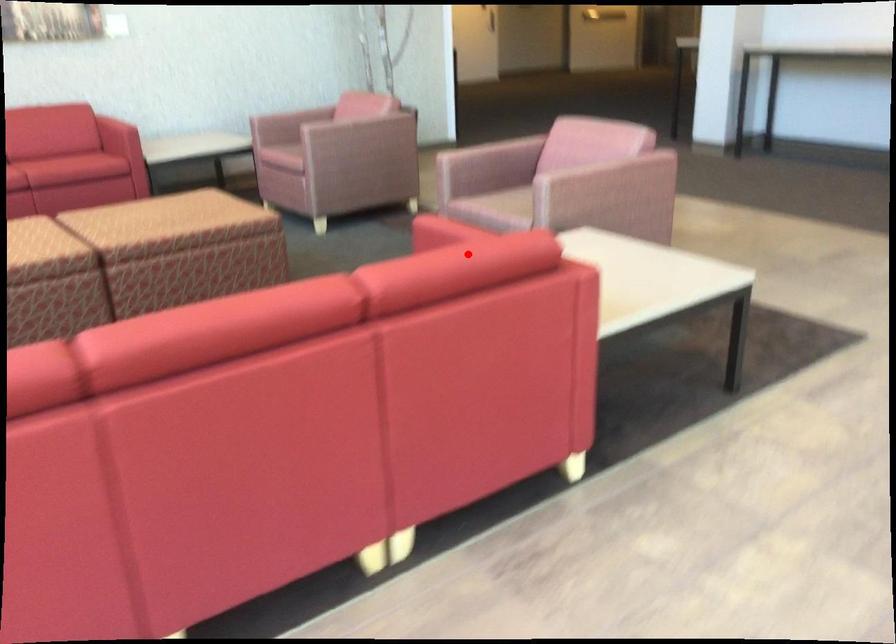
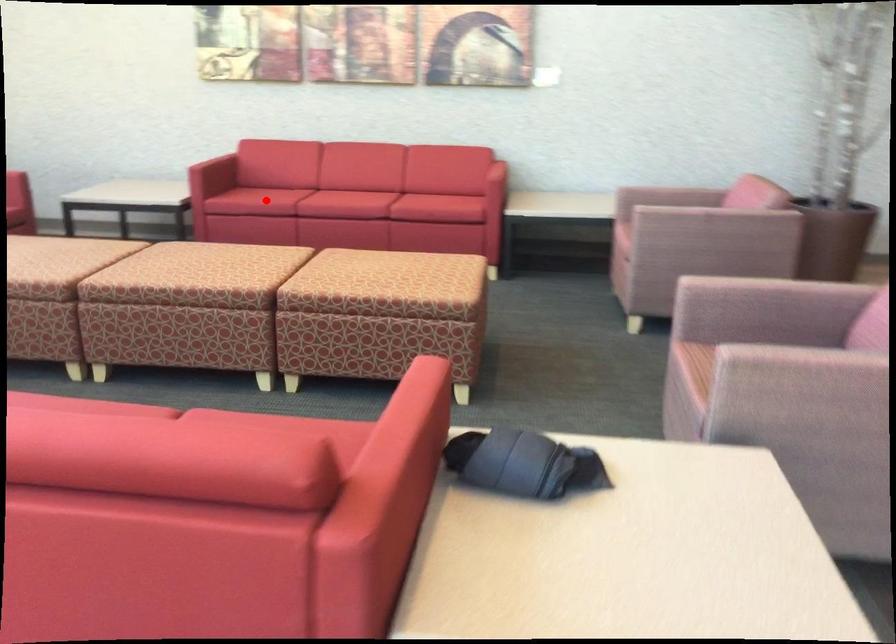
Consider the image. I am providing you with two images of the same scene from different viewpoints. A red point is marked on the first image and another point is marked on the second image. Is the marked point in image1 the same physical position as the marked point in image2?

No